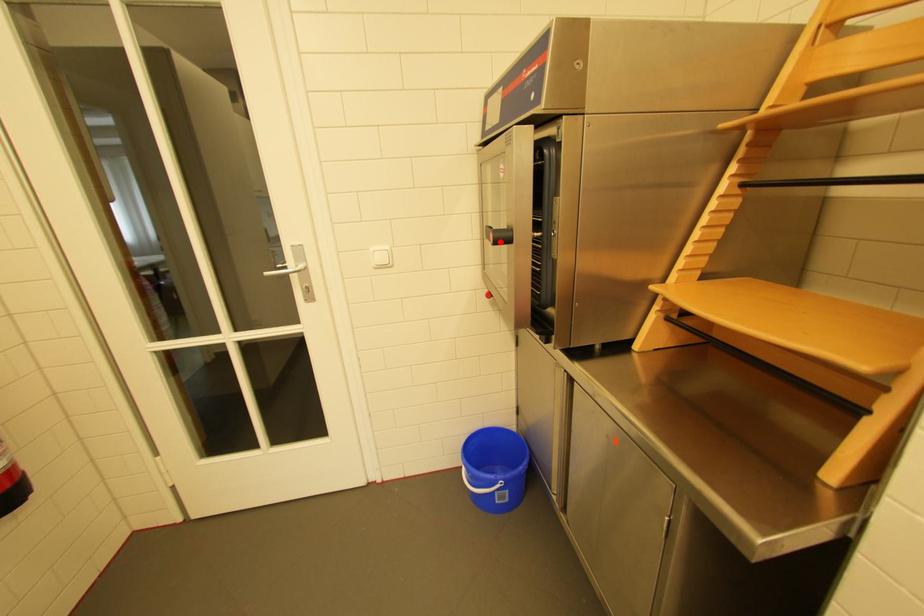
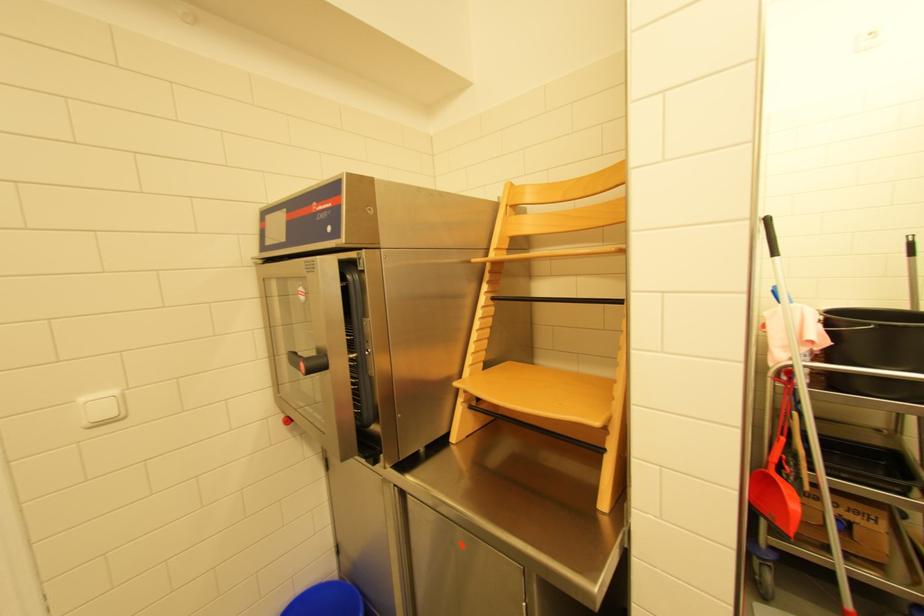
In the second image, find the point that corresponds to the highlighted location in the first image.

(311, 371)